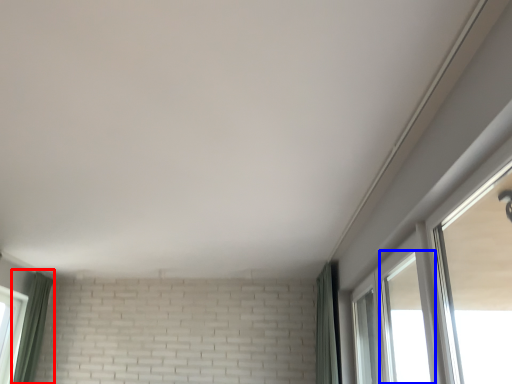
Question: Which point is closer to the camera, curtain (highlighted by a red box) or window (highlighted by a blue box)?

Choices:
 (A) curtain
 (B) window

Answer: (B)